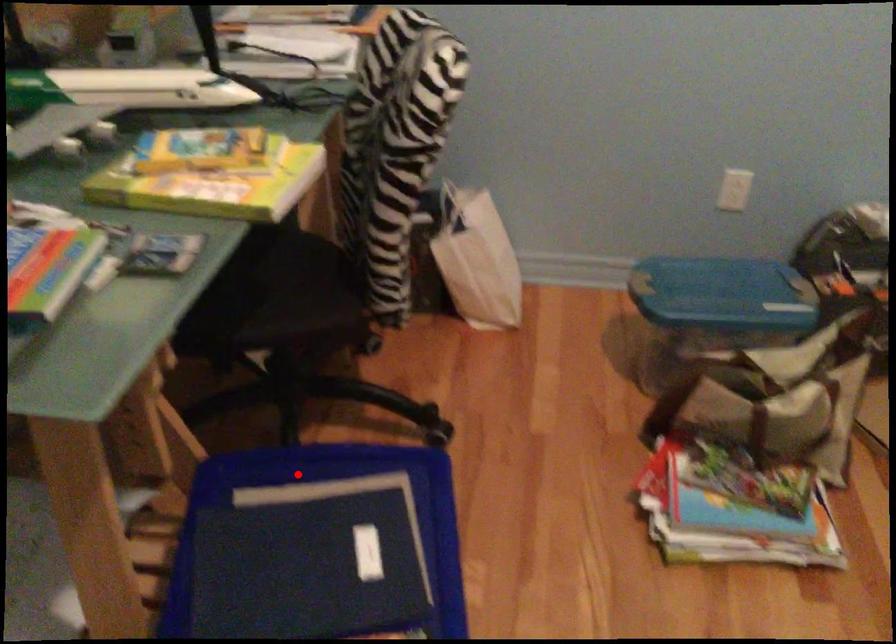
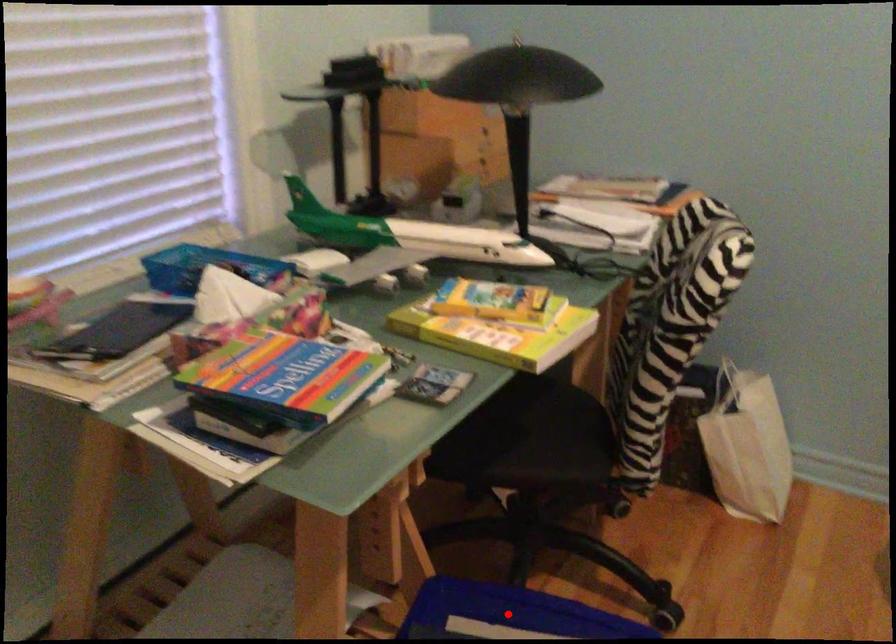
I am providing you with two images of the same scene from different viewpoints. A red point is marked on the first image and another point is marked on the second image. Are the points marked in image1 and image2 representing the same 3D position?

Yes